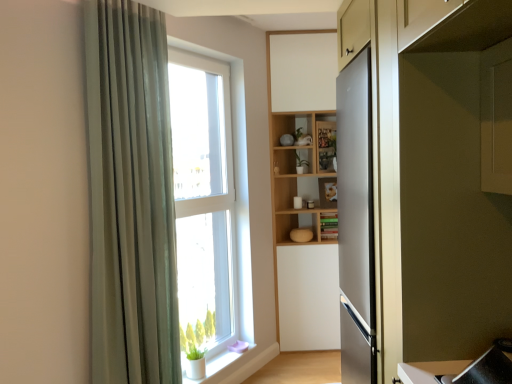
The image size is (512, 384). I want to click on free spot above white matte window sill at lower left (from a real-world perspective), so click(x=221, y=357).